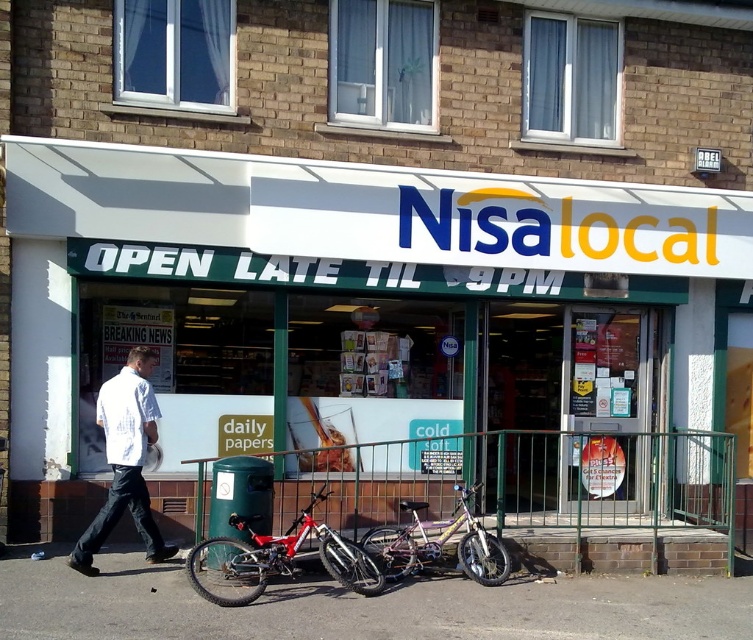
Question: From the image, what is the correct spatial relationship of shiny metallic bicycle at center in relation to white shirt at center?

Choices:
 (A) above
 (B) below

Answer: (B)

Question: Which of the following is the farthest from the observer?

Choices:
 (A) white plastic signboard at upper center
 (B) shiny metallic bicycle at center
 (C) metallic silver bicycle at center
 (D) white shirt at center

Answer: (A)

Question: Which object is positioned closest to the smooth asphalt pavement at lower center?

Choices:
 (A) shiny metallic bicycle at center
 (B) white plastic signboard at upper center
 (C) white shirt at center

Answer: (A)

Question: Observing the image, what is the correct spatial positioning of smooth asphalt pavement at lower center in reference to shiny metallic bicycle at center?

Choices:
 (A) right
 (B) left

Answer: (B)

Question: Which object is farther from the camera taking this photo?

Choices:
 (A) metallic silver bicycle at center
 (B) white shirt at center
 (C) smooth asphalt pavement at lower center
 (D) shiny metallic bicycle at center

Answer: (A)

Question: Is white plastic signboard at upper center closer to the viewer compared to white shirt at center?

Choices:
 (A) yes
 (B) no

Answer: (B)